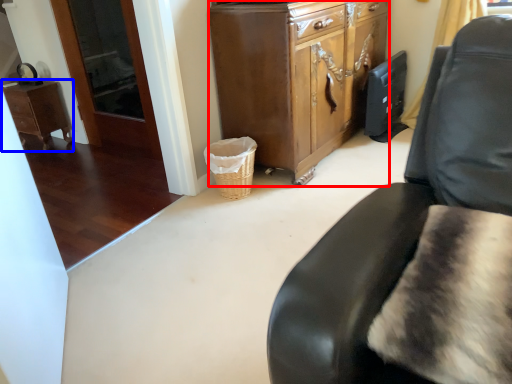
Question: Which point is closer to the camera, cabinetry (highlighted by a red box) or desk (highlighted by a blue box)?

Choices:
 (A) cabinetry
 (B) desk

Answer: (A)